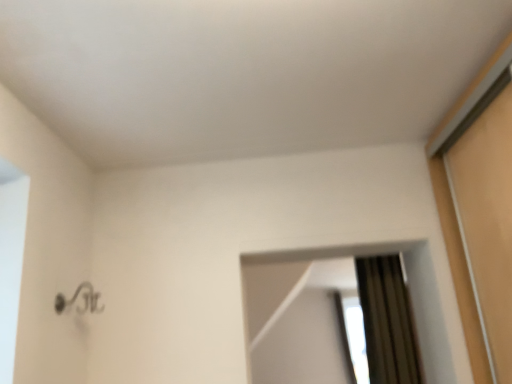
Question: Is matte brown mirror at right wider than transparent glass window at upper right?

Choices:
 (A) yes
 (B) no

Answer: (B)

Question: Considering the relative positions of matte brown mirror at right and transparent glass window at upper right in the image provided, is matte brown mirror at right to the right of transparent glass window at upper right from the viewer's perspective?

Choices:
 (A) no
 (B) yes

Answer: (A)

Question: From the image's perspective, is matte brown mirror at right below transparent glass window at upper right?

Choices:
 (A) yes
 (B) no

Answer: (B)

Question: Considering the relative sizes of matte brown mirror at right and transparent glass window at upper right in the image provided, is matte brown mirror at right smaller than transparent glass window at upper right?

Choices:
 (A) no
 (B) yes

Answer: (B)

Question: Is matte brown mirror at right further to camera compared to transparent glass window at upper right?

Choices:
 (A) yes
 (B) no

Answer: (B)

Question: Would you say matte brown mirror at right is a long distance from transparent glass window at upper right?

Choices:
 (A) no
 (B) yes

Answer: (A)

Question: Is transparent glass window at upper right to the right of matte brown mirror at right from the viewer's perspective?

Choices:
 (A) yes
 (B) no

Answer: (A)

Question: Is transparent glass window at upper right at the left side of matte brown mirror at right?

Choices:
 (A) no
 (B) yes

Answer: (A)

Question: Is transparent glass window at upper right thinner than matte brown mirror at right?

Choices:
 (A) yes
 (B) no

Answer: (B)

Question: Considering the relative sizes of transparent glass window at upper right and matte brown mirror at right in the image provided, is transparent glass window at upper right wider than matte brown mirror at right?

Choices:
 (A) yes
 (B) no

Answer: (A)

Question: Does transparent glass window at upper right lie behind matte brown mirror at right?

Choices:
 (A) no
 (B) yes

Answer: (B)

Question: From the image's perspective, does transparent glass window at upper right appear higher than matte brown mirror at right?

Choices:
 (A) no
 (B) yes

Answer: (A)

Question: From their relative heights in the image, would you say matte brown mirror at right is taller or shorter than transparent glass window at upper right?

Choices:
 (A) tall
 (B) short

Answer: (B)